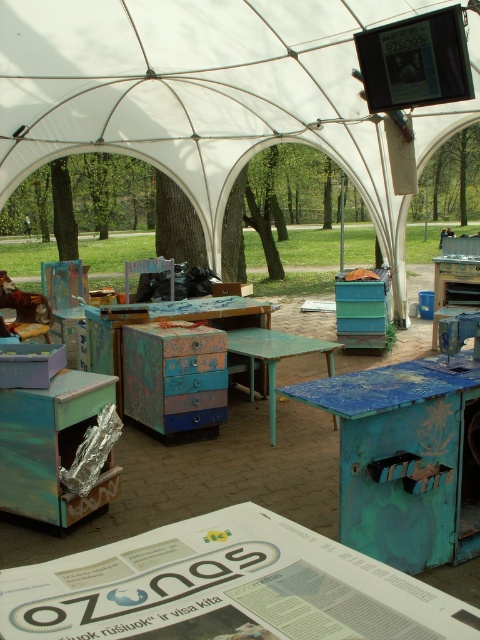
Who is taller, metallic blue drawer at lower left or teal painted wood table at center?

teal painted wood table at center

Between metallic blue drawer at lower left and teal painted wood table at center, which one is positioned higher?

teal painted wood table at center is higher up.

Find the location of a particular element. metallic blue drawer at lower left is located at coordinates (51, 445).

Which of these two, white fabric canopy at center or teal painted wood table at center, stands shorter?

teal painted wood table at center

Which is behind, point (12, 97) or point (264, 342)?

Point (12, 97)

Locate an element on the screen. This screenshot has height=640, width=480. white fabric canopy at center is located at coordinates (197, 93).

Is blue painted wood table at center positioned before metallic blue drawer at lower left?

Yes, blue painted wood table at center is closer to the viewer.

Is point (432, 460) behind point (103, 481)?

No, it is not.

The height and width of the screenshot is (640, 480). What do you see at coordinates (407, 458) in the screenshot?
I see `blue painted wood table at center` at bounding box center [407, 458].

Where is `blue painted wood table at center`? blue painted wood table at center is located at coordinates (407, 458).